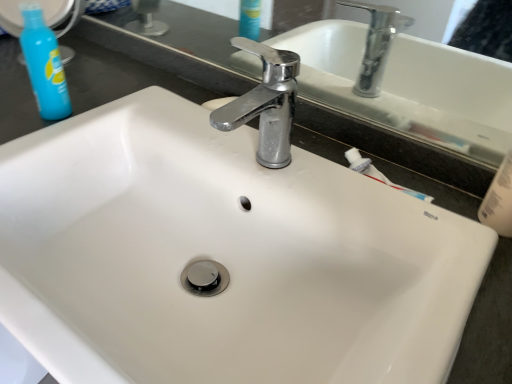
Image resolution: width=512 pixels, height=384 pixels. What do you see at coordinates (44, 64) in the screenshot? I see `blue plastic bottle at upper left` at bounding box center [44, 64].

At what (x,y) coordinates should I click in order to perform the action: click on blue plastic bottle at upper left. Please return your answer as a coordinate pair (x, y). Looking at the image, I should click on (44, 64).

The image size is (512, 384). Describe the element at coordinates (265, 103) in the screenshot. I see `chrome metallic faucet at center` at that location.

This screenshot has width=512, height=384. What are the coordinates of `chrome metallic faucet at center` in the screenshot? It's located at (265, 103).

Identify the location of blue plastic bottle at upper left. This screenshot has width=512, height=384. (44, 64).

Considering the positions of objects blue plastic bottle at upper left and chrome metallic faucet at center in the image provided, who is more to the right, blue plastic bottle at upper left or chrome metallic faucet at center?

Positioned to the right is chrome metallic faucet at center.

Is blue plastic bottle at upper left behind chrome metallic faucet at center?

Yes, blue plastic bottle at upper left is further from the viewer.

Considering the points (53, 48) and (214, 114), which point is in front, point (53, 48) or point (214, 114)?

The point (214, 114) is in front.

From the image's perspective, which one is positioned lower, blue plastic bottle at upper left or chrome metallic faucet at center?

chrome metallic faucet at center is shown below in the image.

From a real-world perspective, is blue plastic bottle at upper left positioned over chrome metallic faucet at center based on gravity?

No, from a real-world perspective, blue plastic bottle at upper left is not on top of chrome metallic faucet at center.

Is blue plastic bottle at upper left wider than chrome metallic faucet at center?

No.

Considering the sizes of blue plastic bottle at upper left and chrome metallic faucet at center in the image, is blue plastic bottle at upper left taller or shorter than chrome metallic faucet at center?

blue plastic bottle at upper left is taller than chrome metallic faucet at center.

Can you confirm if blue plastic bottle at upper left is bigger than chrome metallic faucet at center?

Incorrect, blue plastic bottle at upper left is not larger than chrome metallic faucet at center.

Is blue plastic bottle at upper left positioned beyond the bounds of chrome metallic faucet at center?

Yes, blue plastic bottle at upper left is located beyond the bounds of chrome metallic faucet at center.

Are blue plastic bottle at upper left and chrome metallic faucet at center far apart?

No, blue plastic bottle at upper left is not far away from chrome metallic faucet at center.

Is blue plastic bottle at upper left positioned with its back to chrome metallic faucet at center?

That's not correct — blue plastic bottle at upper left is not looking away from chrome metallic faucet at center.

The image size is (512, 384). Identify the location of tap on the right of blue plastic bottle at upper left. (265, 103).

Based on their positions, is chrome metallic faucet at center located to the left or right of blue plastic bottle at upper left?

Based on their positions, chrome metallic faucet at center is located to the right of blue plastic bottle at upper left.

From the picture: Is the position of chrome metallic faucet at center less distant than that of blue plastic bottle at upper left?

Yes, chrome metallic faucet at center is closer to the viewer.

Which is in front, point (229, 121) or point (61, 63)?

The point (229, 121) is more forward.

From the image's perspective, which is below, chrome metallic faucet at center or blue plastic bottle at upper left?

chrome metallic faucet at center, from the image's perspective.

From a real-world perspective, between chrome metallic faucet at center and blue plastic bottle at upper left, who is vertically lower?

blue plastic bottle at upper left.

Is chrome metallic faucet at center thinner than blue plastic bottle at upper left?

In fact, chrome metallic faucet at center might be wider than blue plastic bottle at upper left.

Which of these two, chrome metallic faucet at center or blue plastic bottle at upper left, stands taller?

With more height is blue plastic bottle at upper left.

Can you confirm if chrome metallic faucet at center is smaller than blue plastic bottle at upper left?

Incorrect, chrome metallic faucet at center is not smaller in size than blue plastic bottle at upper left.

Is chrome metallic faucet at center positioned beyond the bounds of blue plastic bottle at upper left?

Indeed, chrome metallic faucet at center is completely outside blue plastic bottle at upper left.

Does chrome metallic faucet at center touch blue plastic bottle at upper left?

No.

Is chrome metallic faucet at center turned away from blue plastic bottle at upper left?

No.

How different are the orientations of chrome metallic faucet at center and blue plastic bottle at upper left in degrees?

chrome metallic faucet at center and blue plastic bottle at upper left are facing 1.55 degrees away from each other.

This screenshot has height=384, width=512. What are the coordinates of `cleaning product above the chrome metallic faucet at center (from the image's perspective)` in the screenshot? It's located at (44, 64).

Where is `tap in front of the blue plastic bottle at upper left`? The image size is (512, 384). tap in front of the blue plastic bottle at upper left is located at coordinates (265, 103).

Find the location of `tap that is on the right side of blue plastic bottle at upper left`. tap that is on the right side of blue plastic bottle at upper left is located at coordinates (265, 103).